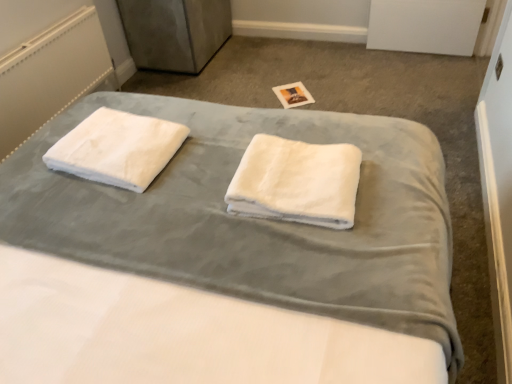
Question: From a real-world perspective, is white soft towel at left, which is the 2th towel from right to left, positioned above or below white fluffy towel at center, the 2th towel positioned from the left?

Choices:
 (A) above
 (B) below

Answer: (B)

Question: In terms of height, does white soft towel at left, the 1th towel viewed from the left, look taller or shorter compared to white fluffy towel at center, the 2th towel positioned from the left?

Choices:
 (A) short
 (B) tall

Answer: (A)

Question: Estimate the real-world distances between objects in this image. Which object is closer to the white fabric radiator at upper left?

Choices:
 (A) white fluffy towel at center, marked as the 1th towel in a right-to-left arrangement
 (B) white soft towel at left, which is the 2th towel from right to left
 (C) white soft towels at center

Answer: (B)

Question: Estimate the real-world distances between objects in this image. Which object is closer to the white soft towels at center?

Choices:
 (A) white fabric radiator at upper left
 (B) white soft towel at left, which is the 2th towel from right to left
 (C) white fluffy towel at center, marked as the 1th towel in a right-to-left arrangement

Answer: (C)